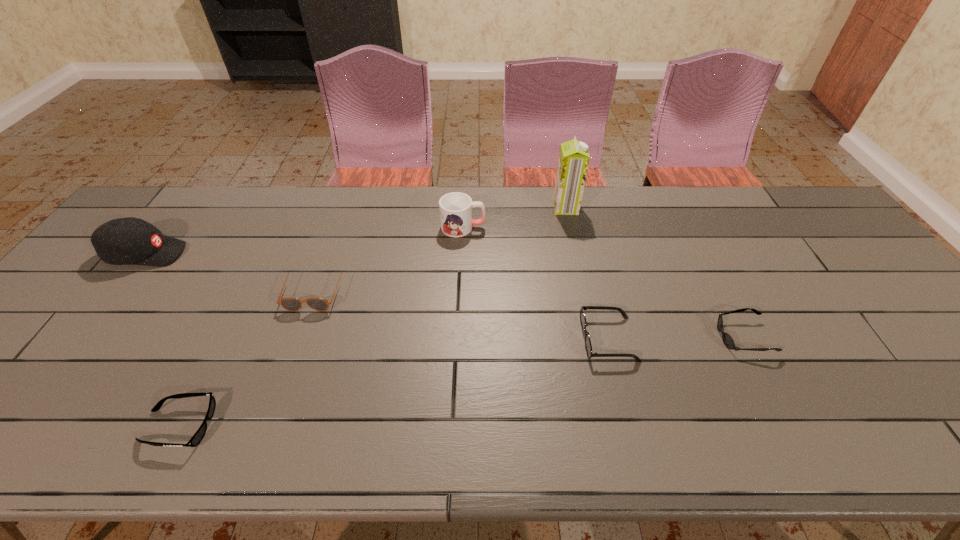
At what (x,y) coordinates should I click in order to perform the action: click on vacant space positioned 0.170m on the front-facing side of the sixth object from right to left. Please return your answer as a coordinate pair (x, y). This screenshot has height=540, width=960. Looking at the image, I should click on (294, 426).

Locate an element on the screen. This screenshot has width=960, height=540. soya milk that is at the far edge is located at coordinates (573, 162).

I want to click on mug located in the far edge section of the desktop, so click(x=455, y=208).

Identify the location of object that is at the near edge. (198, 436).

The height and width of the screenshot is (540, 960). What are the coordinates of `object located at the left edge` in the screenshot? It's located at (124, 241).

Image resolution: width=960 pixels, height=540 pixels. Find the location of `vacant space at the far edge of the desktop`. vacant space at the far edge of the desktop is located at coordinates (644, 211).

The image size is (960, 540). I want to click on blank space at the near edge, so click(x=734, y=450).

In the image, there is a desktop. Identify the location of free space at the left edge. This screenshot has height=540, width=960. (99, 269).

Image resolution: width=960 pixels, height=540 pixels. Find the location of `vacant space at the right edge of the desktop`. vacant space at the right edge of the desktop is located at coordinates (x=922, y=327).

This screenshot has width=960, height=540. Identify the location of free space between the fourth farthest object and the baseball cap. (230, 272).